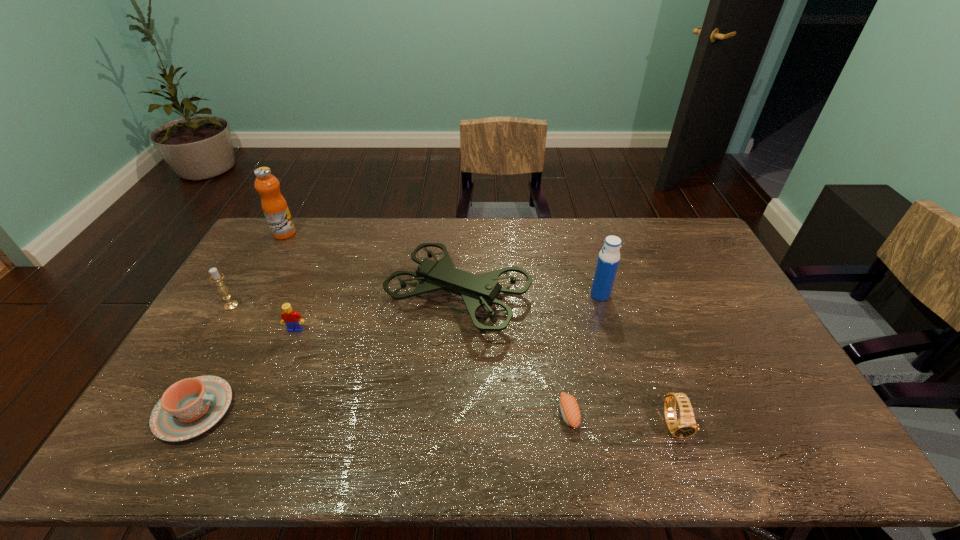
The width and height of the screenshot is (960, 540). Find the location of `vacant area that lies between the watch and the second object from right to left`. vacant area that lies between the watch and the second object from right to left is located at coordinates (636, 360).

Where is `unoccupied area between the fourth tallest object and the chinaware`? This screenshot has width=960, height=540. unoccupied area between the fourth tallest object and the chinaware is located at coordinates (213, 358).

This screenshot has width=960, height=540. In order to click on free space between the sixth object from left to right and the fifth shortest object in this screenshot , I will do `click(399, 360)`.

This screenshot has height=540, width=960. I want to click on free spot between the Lego and the candle holder, so click(x=263, y=318).

This screenshot has height=540, width=960. I want to click on vacant point located between the shortest object and the drone, so click(514, 355).

Where is `free space between the drone and the sushi`? The width and height of the screenshot is (960, 540). free space between the drone and the sushi is located at coordinates (514, 355).

Identify the location of free space that is in between the Lego and the fourth tallest object. 263,318.

The height and width of the screenshot is (540, 960). I want to click on unoccupied area between the shortest object and the drone, so click(514, 355).

Select which object is the closest to the shortest object. Please provide its 2D coordinates. Your answer should be formatted as a tuple, i.e. [(x, y)], where the tuple contains the x and y coordinates of a point satisfying the conditions above.

[(479, 290)]

Identify the location of object that stands as the second closest to the sixth object from left to right. This screenshot has width=960, height=540. (686, 426).